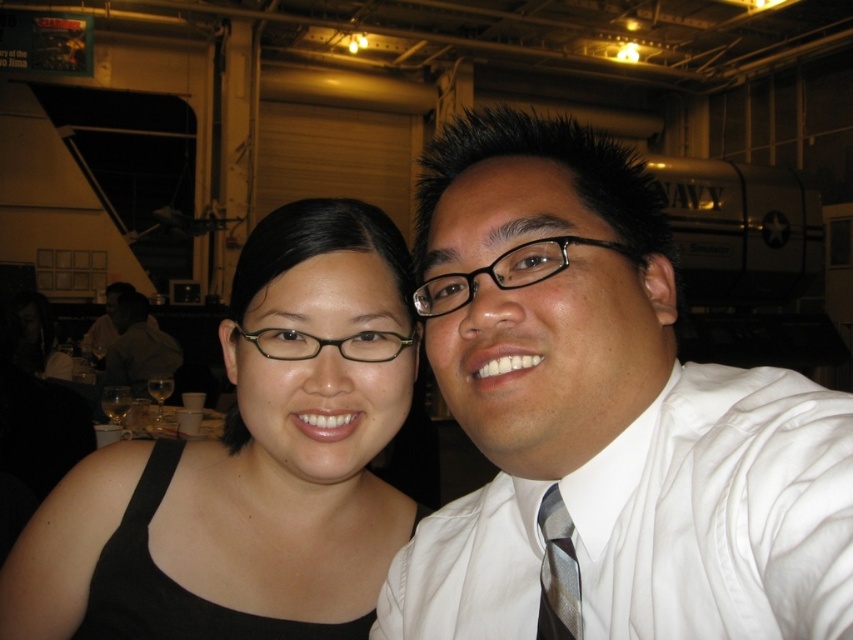
Question: Which point appears closest to the camera in this image?

Choices:
 (A) (167, 493)
 (B) (560, 252)
 (C) (152, 378)

Answer: (B)

Question: Among these points, which one is farthest from the camera?

Choices:
 (A) (148, 308)
 (B) (422, 291)
 (C) (474, 291)
 (D) (573, 627)

Answer: (A)

Question: Which is farther from the black plastic glasses at center?

Choices:
 (A) matte black glasses at center
 (B) silver striped tie at right
 (C) white satin shirt at center
 (D) matte black glasses at left

Answer: (D)

Question: Can you confirm if black matte glasses at upper left is wider than matte black glasses at left?

Choices:
 (A) no
 (B) yes

Answer: (A)

Question: Can you confirm if black matte glasses at upper left is wider than matte black glasses at left?

Choices:
 (A) yes
 (B) no

Answer: (B)

Question: Can you confirm if silver striped tie at right is smaller than matte black glasses at center?

Choices:
 (A) yes
 (B) no

Answer: (A)